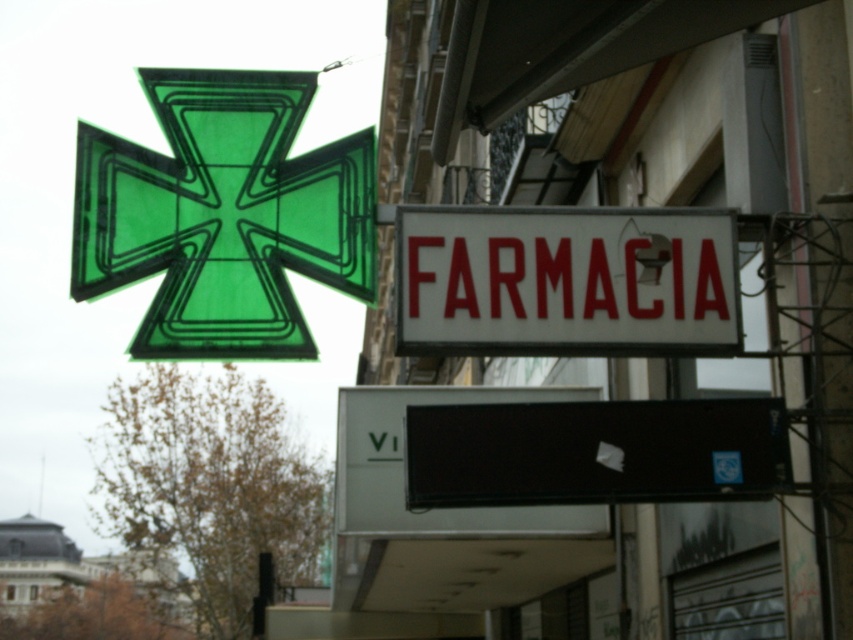
You are a customer standing in front of the pharmacy sign. You want to touch both the green matte cross at upper left and the white matte signboard at center. Which one should you reach for first to touch the one closer to you?

You should reach for the white matte signboard at center first because the green matte cross at upper left is to the left of it, meaning the white matte signboard at center is closer to you.